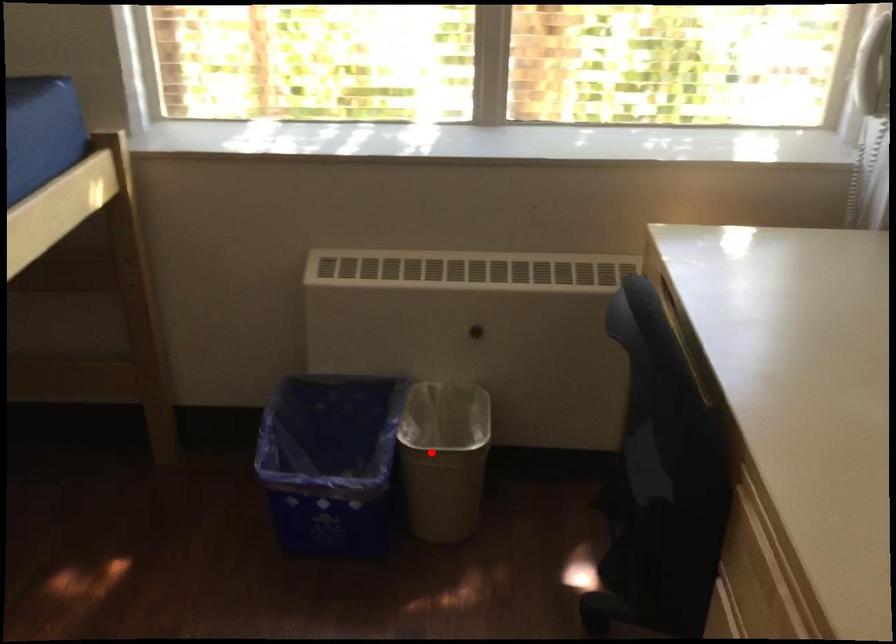
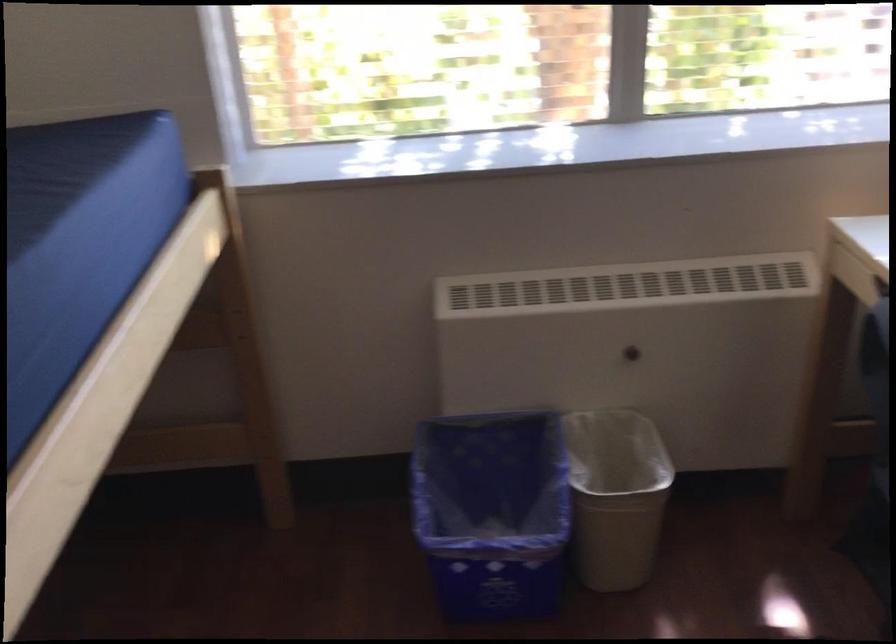
Question: I am providing you with two images of the same scene from different viewpoints. A red point is shown in image1. For the corresponding object point in image2, is it positioned nearer or farther from the camera?

Choices:
 (A) Nearer
 (B) Farther

Answer: (A)